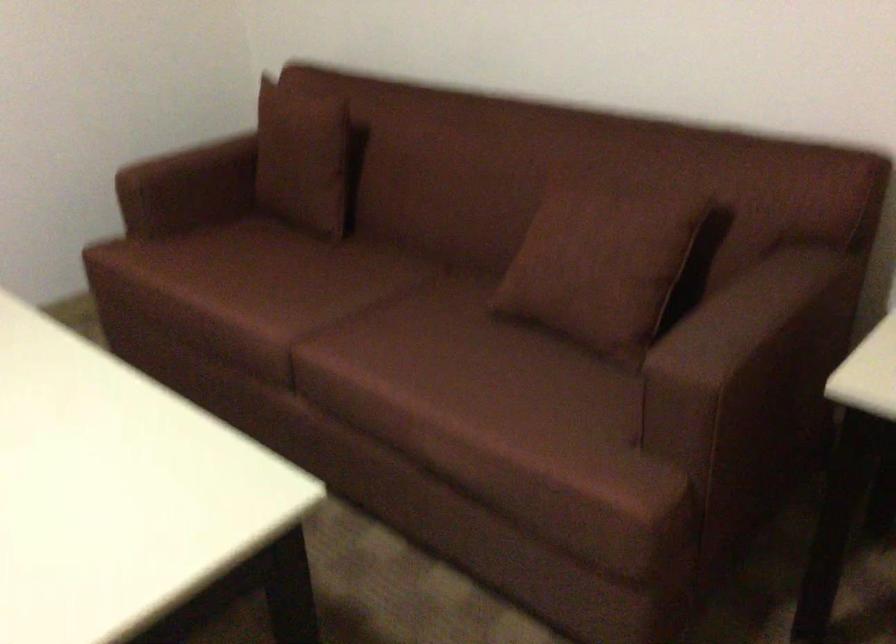
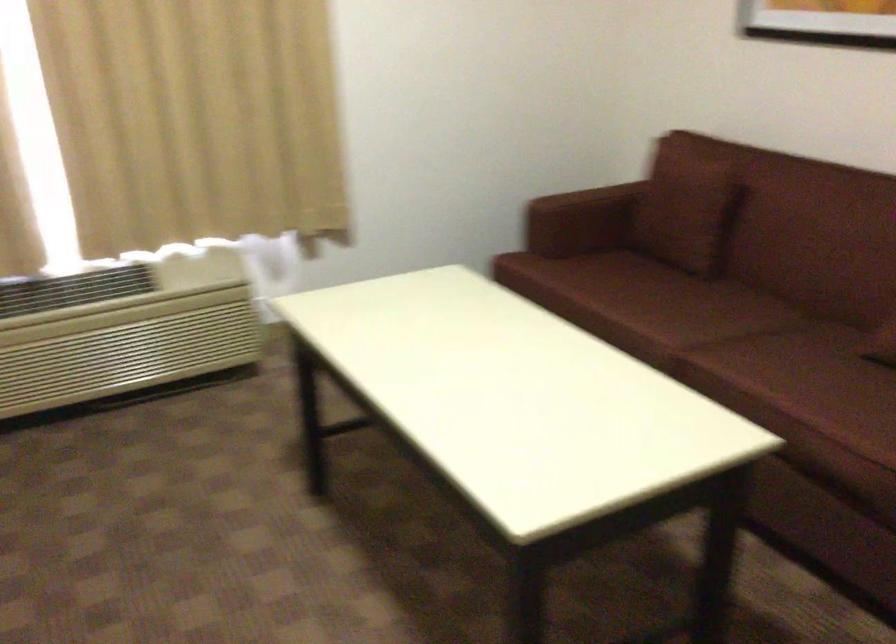
Find the pixel in the second image that matches point 193,199 in the first image.

(573, 225)